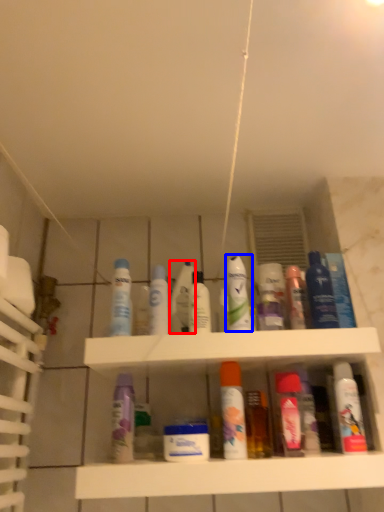
Question: Among these objects, which one is farthest to the camera, mouthwash (highlighted by a red box) or mouthwash (highlighted by a blue box)?

Choices:
 (A) mouthwash
 (B) mouthwash

Answer: (A)